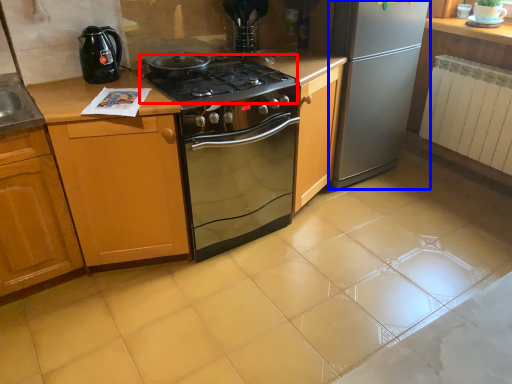
Question: Which object is further to the camera taking this photo, gas stove (highlighted by a red box) or refrigerator (highlighted by a blue box)?

Choices:
 (A) gas stove
 (B) refrigerator

Answer: (B)